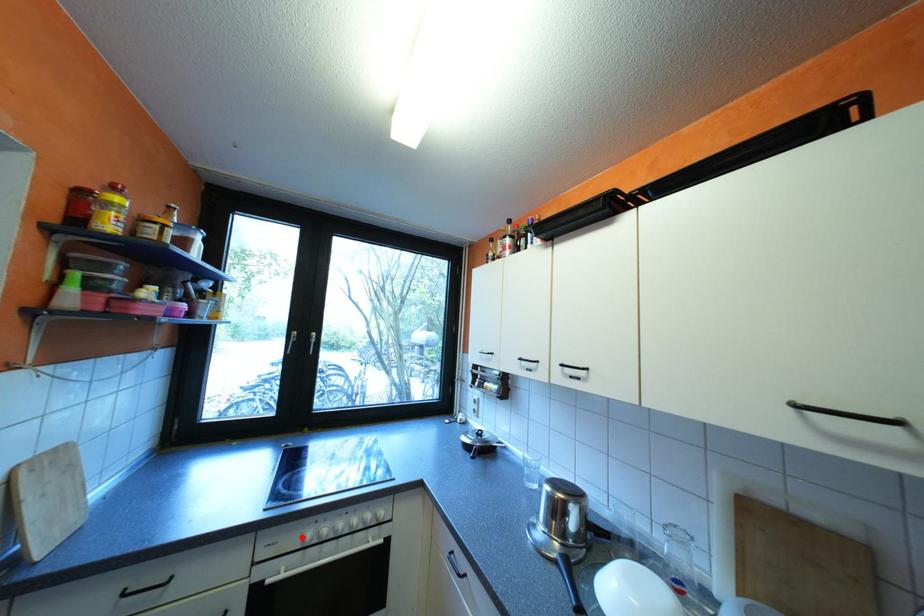
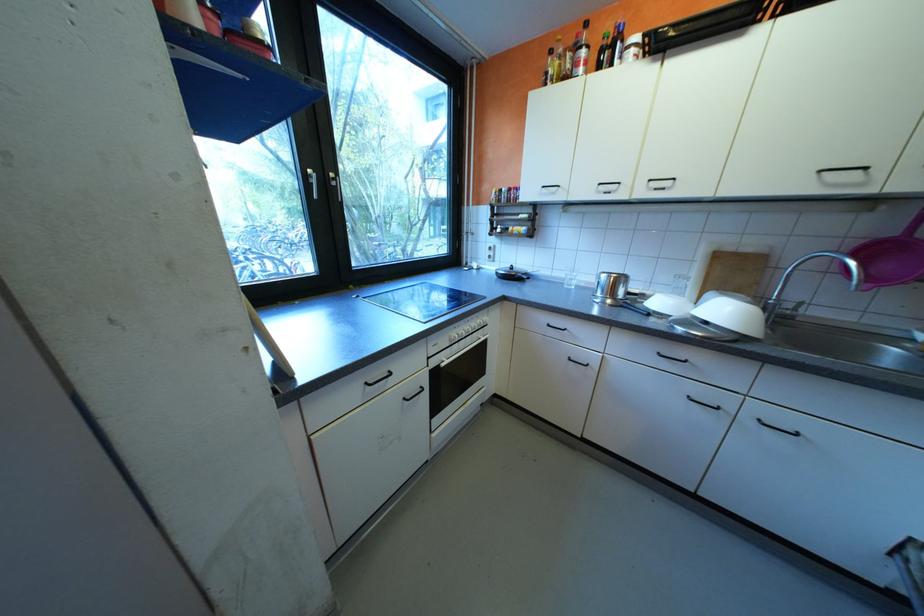
In the second image, find the point that corresponds to the highlighted location in the first image.

(455, 339)